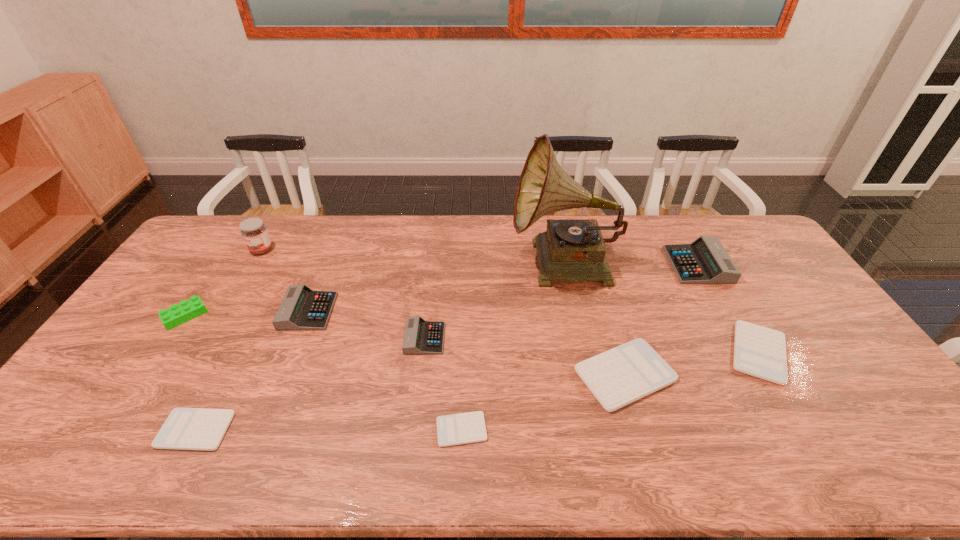
The height and width of the screenshot is (540, 960). Identify the location of record player. pyautogui.click(x=574, y=250).

At what (x,y) coordinates should I click in order to perform the action: click on jam. Please return your answer as a coordinate pair (x, y). This screenshot has height=540, width=960. Looking at the image, I should click on (254, 232).

This screenshot has height=540, width=960. Find the location of `red jam`. red jam is located at coordinates (254, 232).

Image resolution: width=960 pixels, height=540 pixels. In order to click on the biggest gray calculator in this screenshot , I will do tap(705, 261).

You are a GUI agent. You are given a task and a screenshot of the screen. Output one action in this format:
    pyautogui.click(x=<x>, y=<y>)
    Task: Click on the farthest calculator
    The image size is (960, 540).
    Given the screenshot: What is the action you would take?
    pyautogui.click(x=705, y=261)

At what (x,y) coordinates should I click in order to perform the action: click on the second calculator from left to right. Please return your answer as a coordinate pair (x, y). The height and width of the screenshot is (540, 960). Looking at the image, I should click on (302, 308).

Identify the location of the second smallest gray calculator. (302, 308).

The image size is (960, 540). I want to click on the leftmost object, so click(x=176, y=315).

You are a GUI agent. You are given a task and a screenshot of the screen. Output one action in this format:
    pyautogui.click(x=<x>, y=<y>)
    Task: Click on the green Lego
    This screenshot has height=540, width=960.
    Given the screenshot: What is the action you would take?
    pyautogui.click(x=176, y=315)

Find the location of `the fifth shortest object`. the fifth shortest object is located at coordinates 421,337.